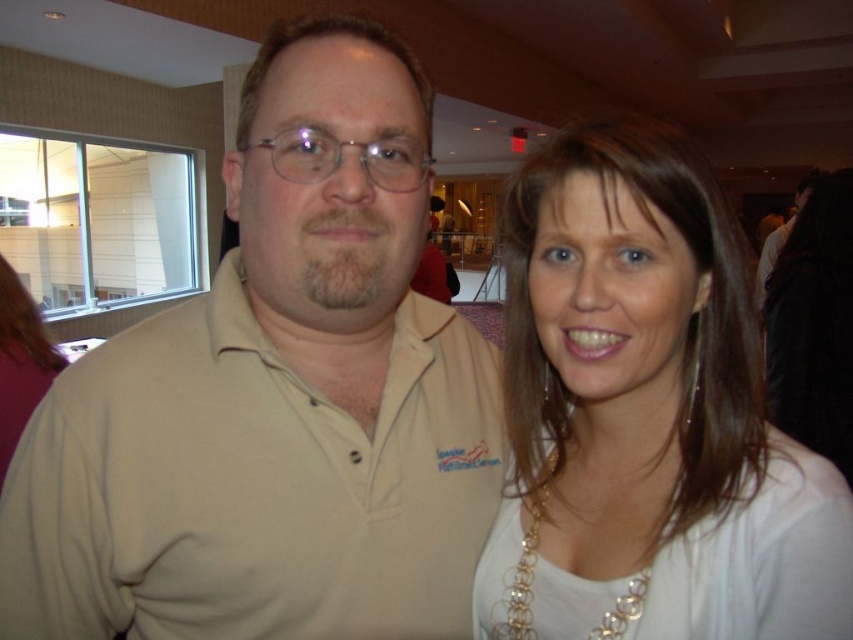
Question: Is beige cotton polo shirt at center smaller than white fabric at upper right?

Choices:
 (A) yes
 (B) no

Answer: (B)

Question: Does beige cotton polo shirt at center appear on the left side of white fabric at upper right?

Choices:
 (A) no
 (B) yes

Answer: (B)

Question: Which point is farther to the camera?

Choices:
 (A) white fabric at upper right
 (B) beige cotton polo shirt at center

Answer: (A)

Question: Can you confirm if beige cotton polo shirt at center is positioned to the left of white fabric at upper right?

Choices:
 (A) yes
 (B) no

Answer: (A)

Question: Which point is closer to the camera?

Choices:
 (A) white fabric at upper right
 (B) beige cotton polo shirt at center

Answer: (B)